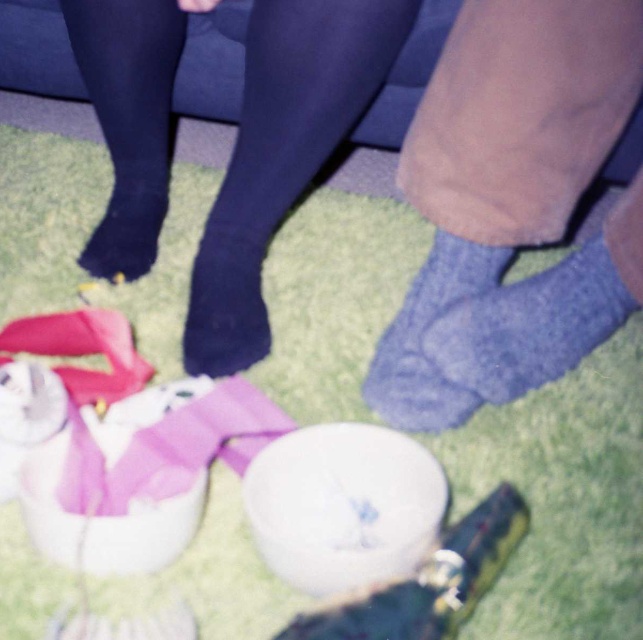
Question: Considering the relative positions of black smooth tights at center and blue knitted sock at lower right in the image provided, where is black smooth tights at center located with respect to blue knitted sock at lower right?

Choices:
 (A) above
 (B) below

Answer: (A)

Question: Which of the following is the farthest from the observer?

Choices:
 (A) blue knitted sock at lower right
 (B) knitted blue sock at lower center
 (C) black smooth tights at center
 (D) blue knitted socks at lower right

Answer: (C)

Question: Is blue knitted sock at lower right above knitted blue sock at lower center?

Choices:
 (A) yes
 (B) no

Answer: (A)

Question: Which object is the farthest from the blue knitted socks at lower right?

Choices:
 (A) blue knitted sock at lower right
 (B) black smooth tights at center
 (C) knitted blue sock at lower center

Answer: (B)

Question: Which point is farther from the camera taking this photo?

Choices:
 (A) (433, 426)
 (B) (343, 77)
 (C) (572, 280)
 (D) (471, 355)

Answer: (B)

Question: Does blue knitted socks at lower right come in front of blue knitted sock at lower right?

Choices:
 (A) no
 (B) yes

Answer: (B)